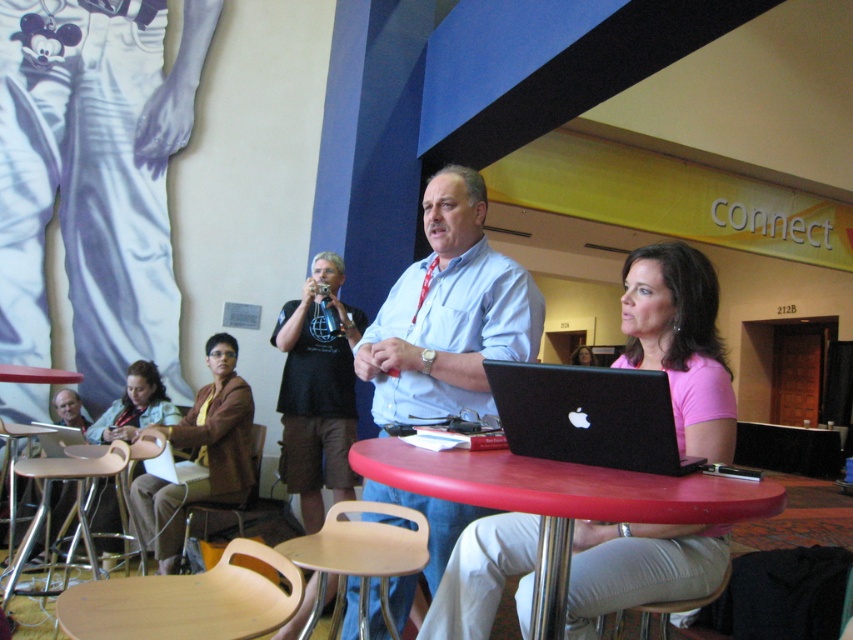
Is black matte laptop at center taller than denim jacket at lower left?

In fact, black matte laptop at center may be shorter than denim jacket at lower left.

Is black matte laptop at center smaller than denim jacket at lower left?

Yes.

Locate an element on the screen. black matte laptop at center is located at coordinates click(x=589, y=416).

You are a GUI agent. You are given a task and a screenshot of the screen. Output one action in this format:
    pyautogui.click(x=<x>, y=<y>)
    Task: Click on the black matte laptop at center
    Image resolution: width=853 pixels, height=640 pixels.
    Given the screenshot: What is the action you would take?
    pyautogui.click(x=589, y=416)

Does point (567, 412) come in front of point (157, 500)?

Yes, point (567, 412) is in front of point (157, 500).

Which is in front, point (608, 449) or point (144, 481)?

Point (608, 449) is in front.

Where is `black matte laptop at center`? The image size is (853, 640). black matte laptop at center is located at coordinates (589, 416).

Can you confirm if pink matte shirt at center is positioned to the right of matte plastic table at center?

Correct, you'll find pink matte shirt at center to the right of matte plastic table at center.

From the picture: Measure the distance between pink matte shirt at center and camera.

The distance of pink matte shirt at center from camera is 4.06 feet.

Who is more distant from viewer, (688, 552) or (561, 477)?

The point (688, 552) is behind.

At what (x,y) coordinates should I click in order to perform the action: click on pink matte shirt at center. Please return your answer as a coordinate pair (x, y). Looking at the image, I should click on (680, 342).